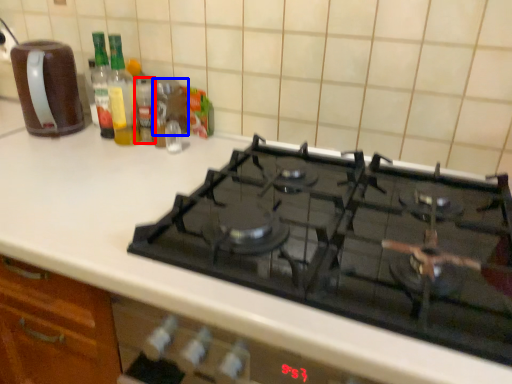
Question: Which of the following is the farthest to the observer, bottle (highlighted by a red box) or appliance (highlighted by a blue box)?

Choices:
 (A) bottle
 (B) appliance

Answer: (B)